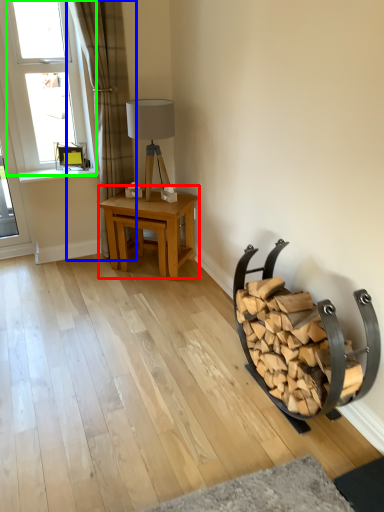
Question: Which object is the closest to the table (highlighted by a red box)? Choose among these: curtain (highlighted by a blue box) or window (highlighted by a green box).

Choices:
 (A) curtain
 (B) window

Answer: (A)